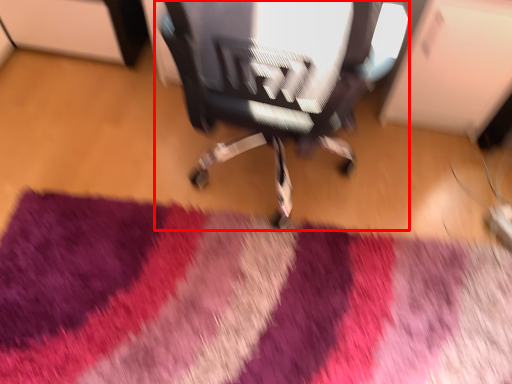
Question: From the image, what is the correct spatial relationship of chair (annotated by the red box) in relation to mat?

Choices:
 (A) right
 (B) left

Answer: (A)